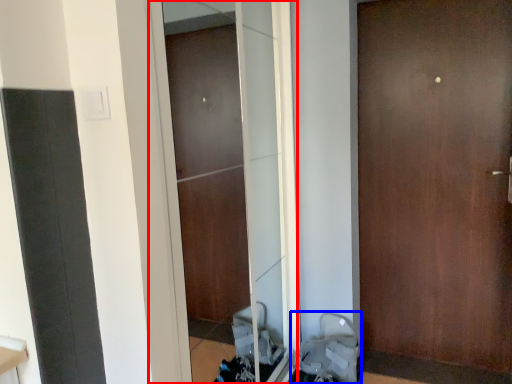
Question: Which point is closer to the camera, screen door (highlighted by a red box) or baby carriage (highlighted by a blue box)?

Choices:
 (A) screen door
 (B) baby carriage

Answer: (A)